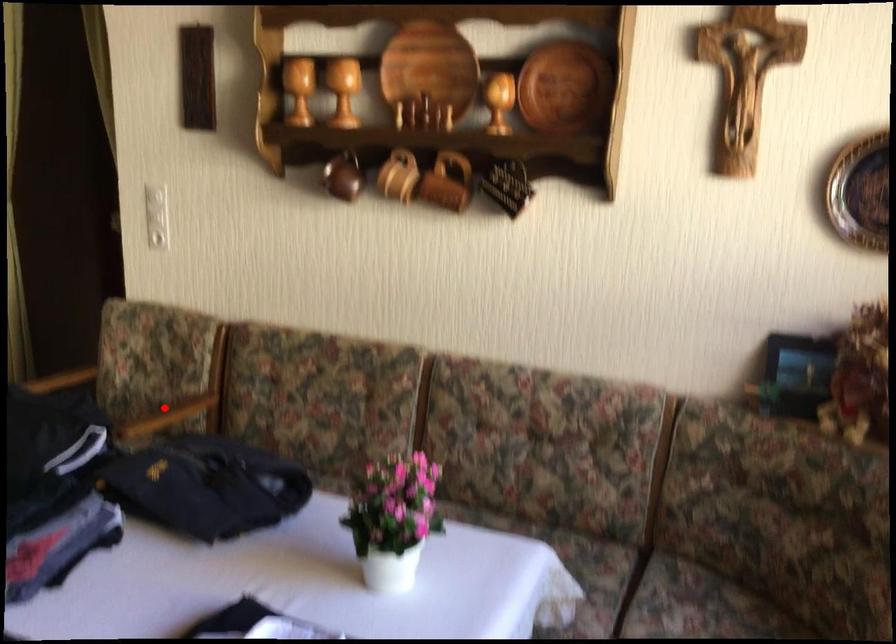
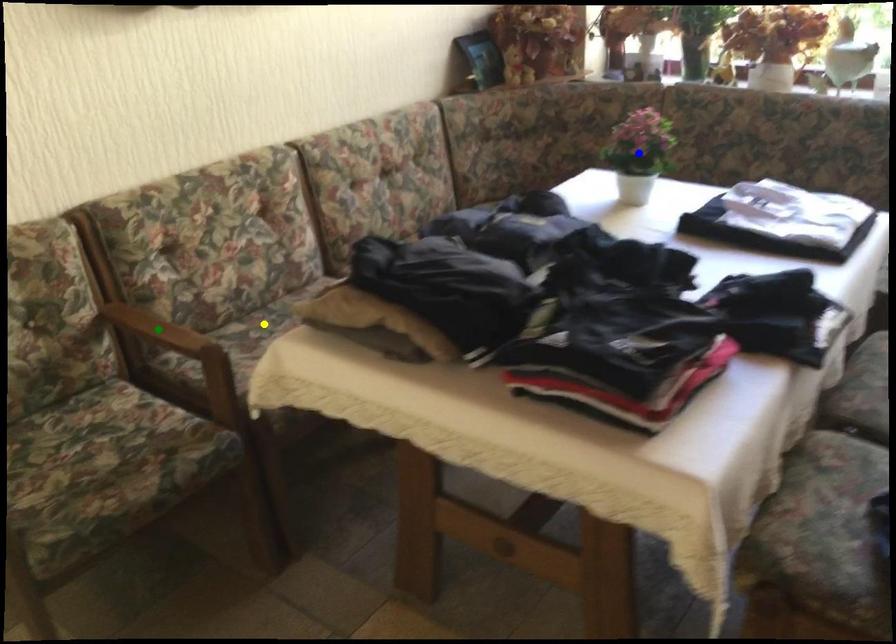
Question: I am providing you with two images of the same scene from different viewpoints. A red point is marked on the first image. You are given multiple points on the second image. Which point in image 2 is actually the same real-world point as the red point in image 1?

Choices:
 (A) green point
 (B) yellow point
 (C) blue point

Answer: (A)